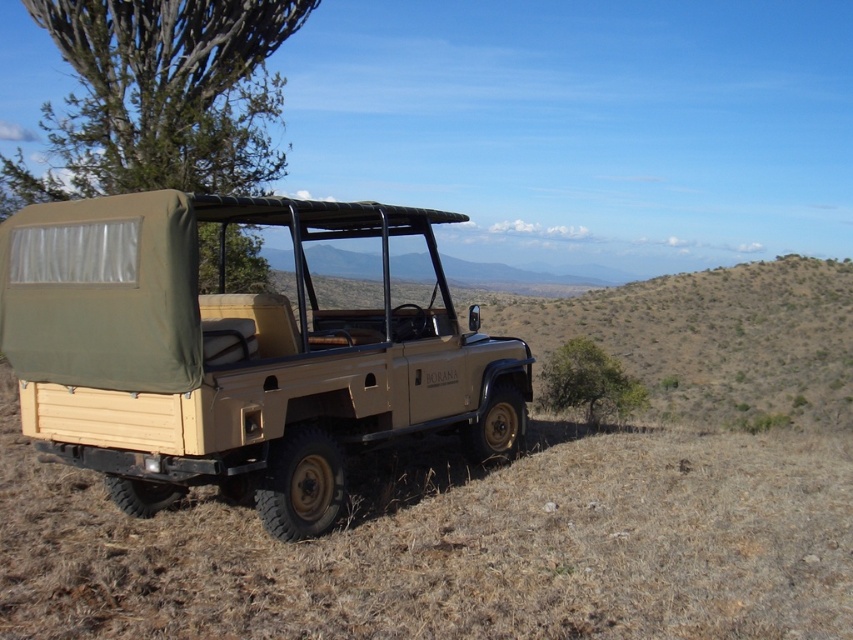
Who is taller, green leafy tree at upper left or green leafy tree at lower right?

green leafy tree at upper left

In the scene shown: Between green leafy tree at upper left and green leafy tree at lower right, which one appears on the right side from the viewer's perspective?

Positioned to the right is green leafy tree at lower right.

Who is more forward, (154,65) or (596,378)?

Point (596,378) is more forward.

At what (x,y) coordinates should I click in order to perform the action: click on green leafy tree at upper left. Please return your answer as a coordinate pair (x, y). The width and height of the screenshot is (853, 640). Looking at the image, I should click on (160, 97).

Between matte khaki jeep at center and green leafy tree at upper left, which one is positioned higher?

Positioned higher is green leafy tree at upper left.

The image size is (853, 640). What do you see at coordinates (234, 355) in the screenshot? I see `matte khaki jeep at center` at bounding box center [234, 355].

Between point (402, 362) and point (216, 108), which one is positioned in front?

Point (402, 362) is in front.

Locate an element on the screen. Image resolution: width=853 pixels, height=640 pixels. matte khaki jeep at center is located at coordinates (234, 355).

Which is more to the left, matte khaki jeep at center or green leafy tree at lower right?

matte khaki jeep at center

Between matte khaki jeep at center and green leafy tree at lower right, which one is positioned higher?

Positioned higher is matte khaki jeep at center.

Which is in front, point (190, 234) or point (614, 356)?

Positioned in front is point (190, 234).

You are a GUI agent. You are given a task and a screenshot of the screen. Output one action in this format:
    pyautogui.click(x=<x>, y=<y>)
    Task: Click on the matte khaki jeep at center
    The height and width of the screenshot is (640, 853).
    Given the screenshot: What is the action you would take?
    pyautogui.click(x=234, y=355)